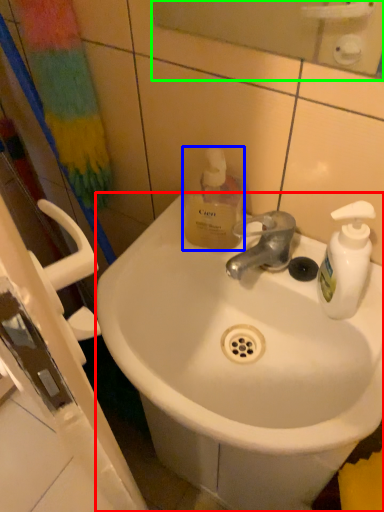
Question: Based on their relative distances, which object is nearer to sink (highlighted by a red box)? Choose from bottle (highlighted by a blue box) and mirror (highlighted by a green box).

Choices:
 (A) bottle
 (B) mirror

Answer: (A)